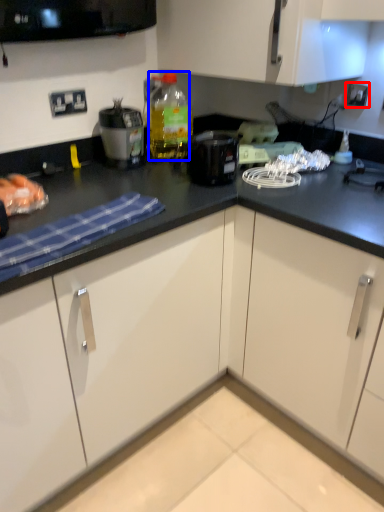
Question: Which object appears farthest to the camera in this image, electric outlet (highlighted by a red box) or bottle (highlighted by a blue box)?

Choices:
 (A) electric outlet
 (B) bottle

Answer: (A)